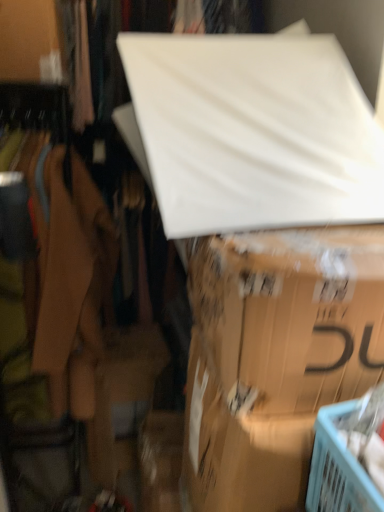
Question: Can you confirm if matte cardboard box at center is bigger than white matte board at upper center?

Choices:
 (A) no
 (B) yes

Answer: (A)

Question: Is matte cardboard box at center smaller than white matte board at upper center?

Choices:
 (A) yes
 (B) no

Answer: (A)

Question: From a real-world perspective, is matte cardboard box at center positioned over white matte board at upper center based on gravity?

Choices:
 (A) yes
 (B) no

Answer: (B)

Question: Is white matte board at upper center at the back of matte cardboard box at center?

Choices:
 (A) yes
 (B) no

Answer: (B)

Question: Is white matte board at upper center completely or partially inside matte cardboard box at center?

Choices:
 (A) no
 (B) yes

Answer: (A)

Question: Is matte cardboard box at center further to the viewer compared to white matte board at upper center?

Choices:
 (A) yes
 (B) no

Answer: (B)

Question: Does white matte board at upper center appear on the right side of white matte board at upper center?

Choices:
 (A) yes
 (B) no

Answer: (A)

Question: Considering the relative sizes of white matte board at upper center and white matte board at upper center in the image provided, is white matte board at upper center wider than white matte board at upper center?

Choices:
 (A) yes
 (B) no

Answer: (A)

Question: Considering the relative positions of white matte board at upper center and white matte board at upper center in the image provided, is white matte board at upper center behind white matte board at upper center?

Choices:
 (A) no
 (B) yes

Answer: (A)

Question: Is white matte board at upper center next to white matte board at upper center and touching it?

Choices:
 (A) no
 (B) yes

Answer: (A)

Question: Does white matte board at upper center have a lesser width compared to white matte board at upper center?

Choices:
 (A) no
 (B) yes

Answer: (A)

Question: From the image's perspective, does white matte board at upper center appear lower than white matte board at upper center?

Choices:
 (A) no
 (B) yes

Answer: (A)

Question: Is white matte board at upper center further to camera compared to matte cardboard box at center?

Choices:
 (A) yes
 (B) no

Answer: (A)